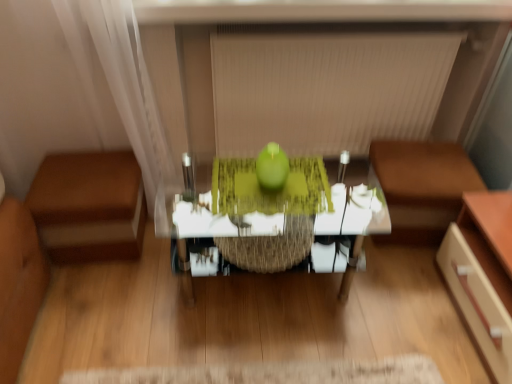
Question: From a real-world perspective, is beige fabric blind at upper center below brown leather ottoman at left, which is the first furniture in left-to-right order?

Choices:
 (A) no
 (B) yes

Answer: (A)

Question: Is beige fabric blind at upper center positioned far away from brown leather ottoman at left, which is the first furniture in left-to-right order?

Choices:
 (A) no
 (B) yes

Answer: (A)

Question: Is beige fabric blind at upper center bigger than brown leather ottoman at left, which is the first furniture in left-to-right order?

Choices:
 (A) yes
 (B) no

Answer: (A)

Question: From the image's perspective, does beige fabric blind at upper center appear higher than brown leather ottoman at left, which is the 2th furniture from right to left?

Choices:
 (A) no
 (B) yes

Answer: (B)

Question: Considering the relative positions of beige fabric blind at upper center and brown leather ottoman at left, which is the first furniture in left-to-right order, in the image provided, is beige fabric blind at upper center to the right of brown leather ottoman at left, which is the first furniture in left-to-right order, from the viewer's perspective?

Choices:
 (A) no
 (B) yes

Answer: (B)

Question: From the image's perspective, is brown leather couch at right, which ranks as the second furniture in left-to-right order, positioned above or below brown leather ottoman at left, which is the 2th furniture from right to left?

Choices:
 (A) below
 (B) above

Answer: (B)

Question: In the image, is brown leather couch at right, the 1th furniture from the right, positioned in front of or behind brown leather ottoman at left, which is the 2th furniture from right to left?

Choices:
 (A) front
 (B) behind

Answer: (B)

Question: Considering the positions of brown leather couch at right, the 1th furniture from the right, and brown leather ottoman at left, which is the first furniture in left-to-right order, in the image, is brown leather couch at right, the 1th furniture from the right, taller or shorter than brown leather ottoman at left, which is the first furniture in left-to-right order,?

Choices:
 (A) short
 (B) tall

Answer: (B)

Question: Considering the positions of brown leather couch at right, the 1th furniture from the right, and brown leather ottoman at left, which is the first furniture in left-to-right order, in the image, is brown leather couch at right, the 1th furniture from the right, bigger or smaller than brown leather ottoman at left, which is the first furniture in left-to-right order,?

Choices:
 (A) big
 (B) small

Answer: (A)

Question: Do you think green matte apple at center is within beige fabric blind at upper center, or outside of it?

Choices:
 (A) outside
 (B) inside

Answer: (A)

Question: Considering the positions of green matte apple at center and beige fabric blind at upper center in the image, is green matte apple at center bigger or smaller than beige fabric blind at upper center?

Choices:
 (A) small
 (B) big

Answer: (A)

Question: Relative to beige fabric blind at upper center, is green matte apple at center in front or behind?

Choices:
 (A) front
 (B) behind

Answer: (A)

Question: From the image's perspective, is green matte apple at center above or below beige fabric blind at upper center?

Choices:
 (A) above
 (B) below

Answer: (B)

Question: Looking at the image, does beige fabric blind at upper center seem bigger or smaller compared to brown leather couch at right, which ranks as the second furniture in left-to-right order?

Choices:
 (A) small
 (B) big

Answer: (B)

Question: Would you say beige fabric blind at upper center is to the left or to the right of brown leather couch at right, which ranks as the second furniture in left-to-right order, in the picture?

Choices:
 (A) left
 (B) right

Answer: (A)